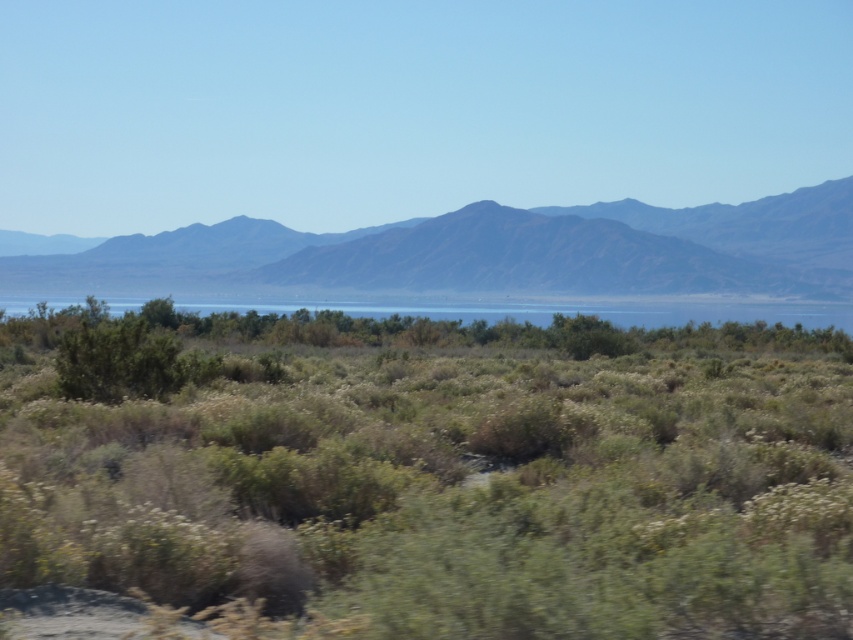
Question: Does rugged brown mountain at center appear over clear blue water at center?

Choices:
 (A) no
 (B) yes

Answer: (B)

Question: In this image, where is rugged brown mountain at center located relative to clear blue water at center?

Choices:
 (A) right
 (B) left

Answer: (B)

Question: Among these points, which one is farthest from the camera?

Choices:
 (A) (122, 538)
 (B) (820, 208)

Answer: (B)

Question: Which point appears farthest from the camera in this image?

Choices:
 (A) (195, 236)
 (B) (807, 312)

Answer: (A)

Question: Which is farther from the green shrubbery at center?

Choices:
 (A) rugged brown mountain at center
 (B) clear blue water at center

Answer: (A)

Question: Considering the relative positions of rugged brown mountain at center and clear blue water at center in the image provided, where is rugged brown mountain at center located with respect to clear blue water at center?

Choices:
 (A) left
 (B) right

Answer: (A)